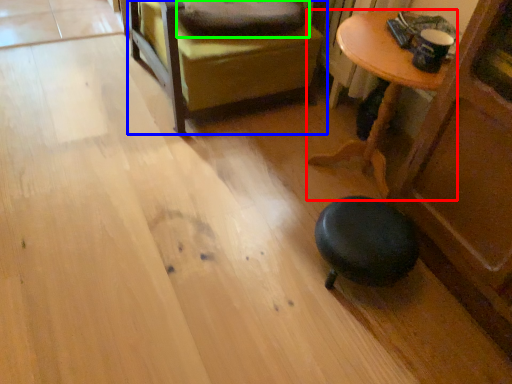
Question: Which object is positioned closest to table (highlighted by a red box)? Select from furniture (highlighted by a blue box) and pillow (highlighted by a green box).

Choices:
 (A) furniture
 (B) pillow

Answer: (A)